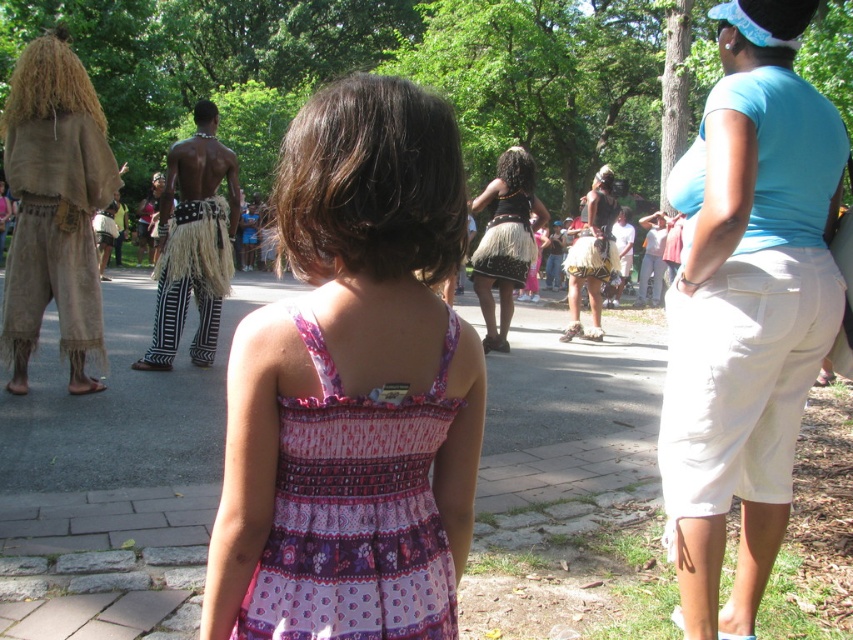
You are a costume designer preparing for a performance. You have two items to place on a rack for quick access during the show. The brown woven fabric at left and the black grass skirt at center. Which item should you place closer to the front of the rack to ensure visibility?

The brown woven fabric at left is larger in size compared to the black grass skirt at center, so placing it closer to the front of the rack will ensure visibility.

You are organizing a costume party and need to ensure that all outfits fit properly. You have a light blue cotton shirt at upper right and a black textured skirt at center. Which item requires a larger size to accommodate its size?

The light blue cotton shirt at upper right requires a larger size because it is bigger than the black textured skirt at center.

You are a photographer at the event and want to capture both the pink printed fabric dress at center and the black woven skirt at center in the same frame. Which object should you focus on first to ensure both are in the shot?

The pink printed fabric dress at center is positioned under the black woven skirt at center, so you should focus on the black woven skirt at center first to ensure both are visible in the frame.